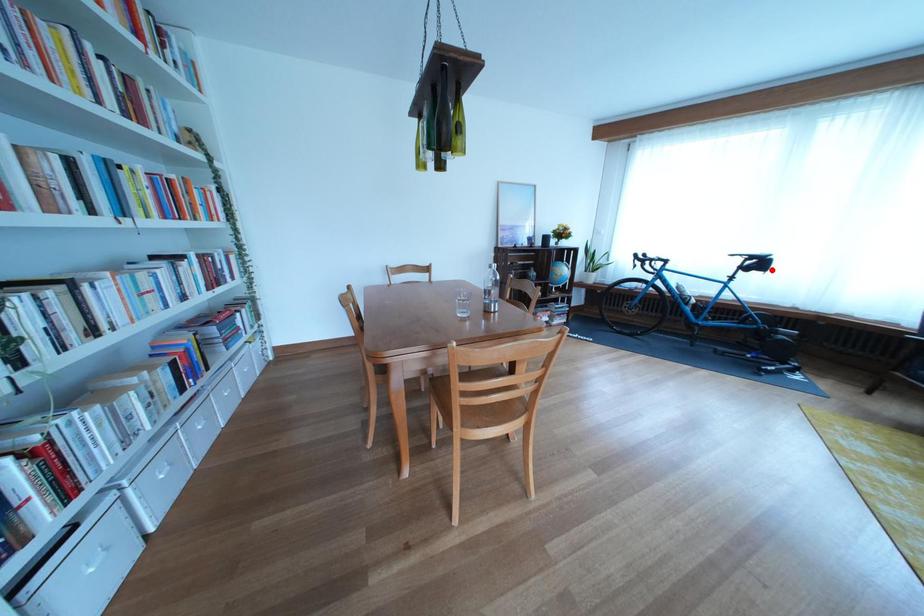
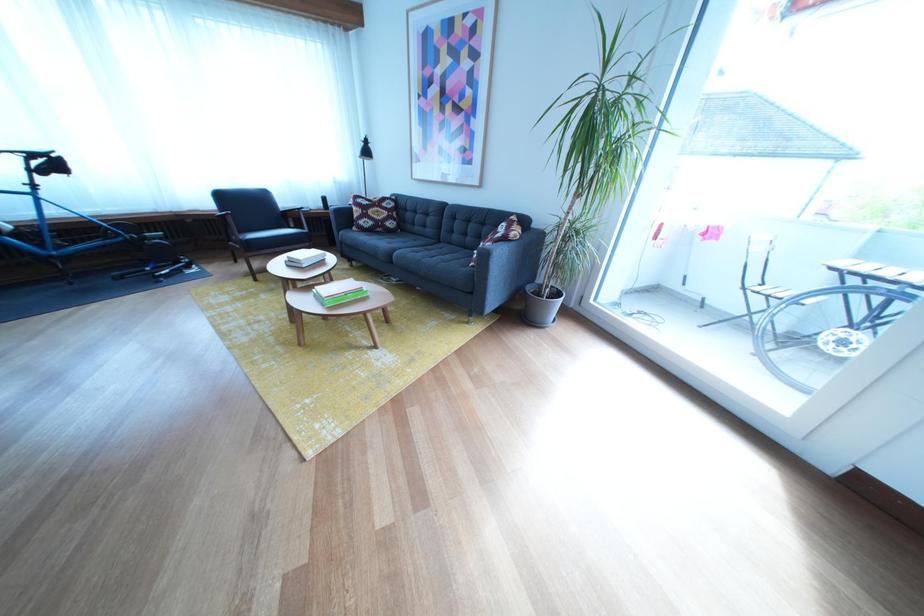
In the second image, find the point that corresponds to the highlighted location in the first image.

(64, 169)